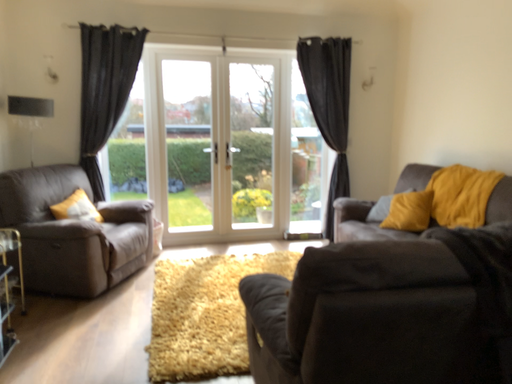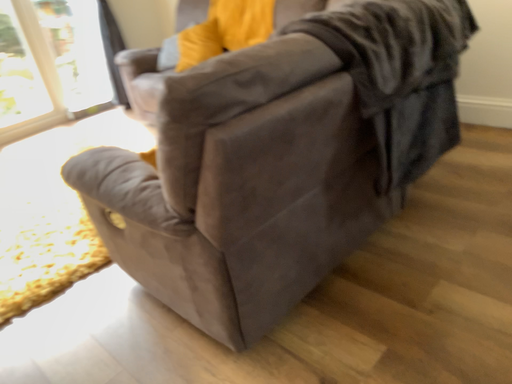
Question: How did the camera likely rotate when shooting the video?

Choices:
 (A) rotated downward
 (B) rotated upward

Answer: (A)